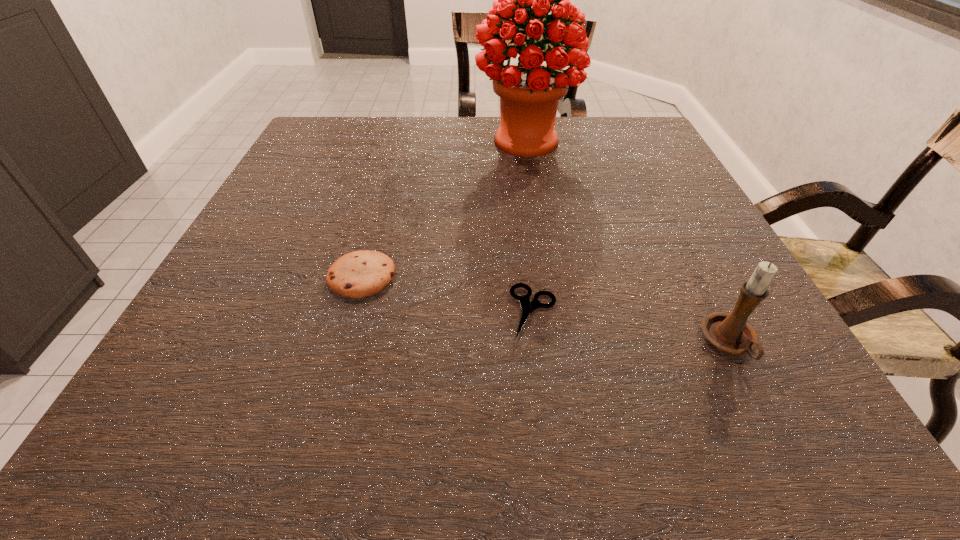
At what (x,y) coordinates should I click in order to perform the action: click on the farthest object. Please return your answer as a coordinate pair (x, y). Image resolution: width=960 pixels, height=540 pixels. Looking at the image, I should click on (529, 91).

Identify the location of the tallest object. (529, 91).

The image size is (960, 540). I want to click on the rightmost object, so click(x=730, y=332).

Where is `the second tallest object`? Image resolution: width=960 pixels, height=540 pixels. the second tallest object is located at coordinates (730, 332).

This screenshot has width=960, height=540. In order to click on the leftmost object in this screenshot , I will do `click(358, 274)`.

At what (x,y) coordinates should I click in order to perform the action: click on cookie. Please return your answer as a coordinate pair (x, y). Looking at the image, I should click on (358, 274).

You are a GUI agent. You are given a task and a screenshot of the screen. Output one action in this format:
    pyautogui.click(x=<x>, y=<y>)
    Task: Click on the shears
    
    Given the screenshot: What is the action you would take?
    pyautogui.click(x=528, y=307)

At what (x,y) coordinates should I click in order to perform the action: click on vacant region located 0.210m on the left of the tallest object. Please return your answer as a coordinate pair (x, y). This screenshot has width=960, height=540. Looking at the image, I should click on (392, 140).

Find the location of a particular element. The image size is (960, 540). free space located on the side of the rightmost object with the handle is located at coordinates (764, 410).

This screenshot has height=540, width=960. In order to click on vacant space located 0.160m on the right of the leftmost object in this screenshot , I will do `click(489, 276)`.